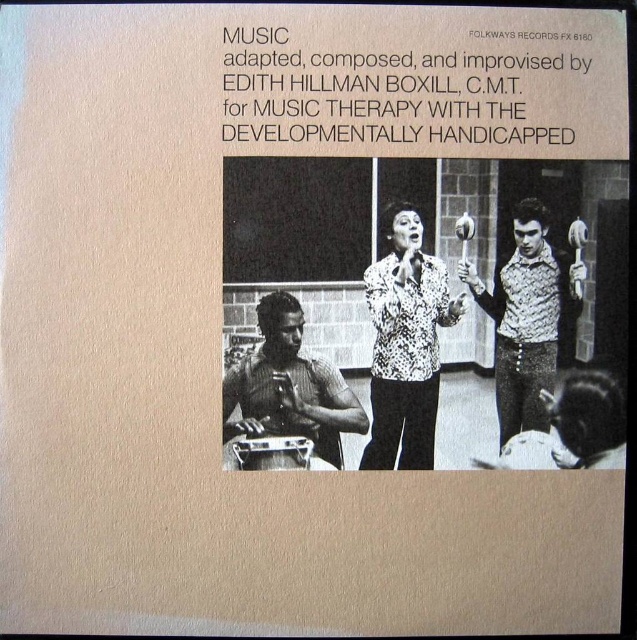
Question: Considering the real-world distances, which object is farthest from the metallic drum at lower left?

Choices:
 (A) spotted patterned shirt at center
 (B) patterned fabric vest at right

Answer: (B)

Question: Among these objects, which one is nearest to the camera?

Choices:
 (A) spotted patterned shirt at center
 (B) patterned fabric vest at right

Answer: (B)

Question: Is spotted patterned shirt at center smaller than metallic drum at lower left?

Choices:
 (A) yes
 (B) no

Answer: (B)

Question: Does patterned fabric vest at right have a larger size compared to metallic drum at lower left?

Choices:
 (A) yes
 (B) no

Answer: (A)

Question: Which is nearer to the metallic drum at lower left?

Choices:
 (A) spotted patterned shirt at center
 (B) patterned fabric vest at right

Answer: (A)

Question: From the image, what is the correct spatial relationship of patterned fabric vest at right in relation to metallic drum at lower left?

Choices:
 (A) left
 (B) right

Answer: (B)